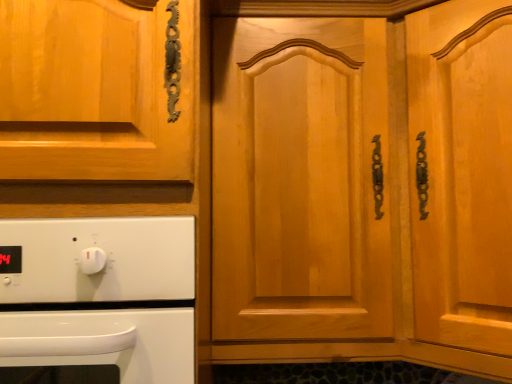
Question: Considering the positions of white glossy oven at lower left and light brown wood door at center in the image, is white glossy oven at lower left wider or thinner than light brown wood door at center?

Choices:
 (A) wide
 (B) thin

Answer: (B)

Question: In the image, is white glossy oven at lower left on the left side or the right side of light brown wood door at center?

Choices:
 (A) right
 (B) left

Answer: (B)

Question: In terms of size, does white glossy oven at lower left appear bigger or smaller than light brown wood door at center?

Choices:
 (A) small
 (B) big

Answer: (A)

Question: From the image's perspective, is light brown wood door at center positioned above or below white glossy oven at lower left?

Choices:
 (A) above
 (B) below

Answer: (A)

Question: In terms of width, does light brown wood door at center look wider or thinner when compared to white glossy oven at lower left?

Choices:
 (A) wide
 (B) thin

Answer: (A)

Question: Is light brown wood door at center in front of or behind white glossy oven at lower left in the image?

Choices:
 (A) front
 (B) behind

Answer: (B)

Question: In terms of size, does light brown wood door at center appear bigger or smaller than white glossy oven at lower left?

Choices:
 (A) big
 (B) small

Answer: (A)